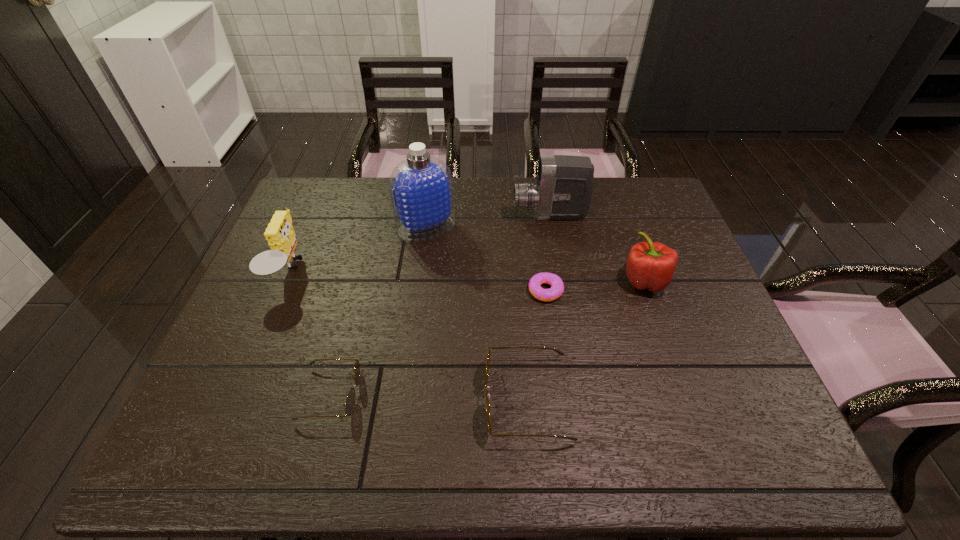
You are a GUI agent. You are given a task and a screenshot of the screen. Output one action in this format:
    pyautogui.click(x=<x>, y=<y>)
    Task: Click on the sixth object from right to left
    
    Given the screenshot: What is the action you would take?
    pyautogui.click(x=350, y=400)

Image resolution: width=960 pixels, height=540 pixels. Identify the location of the second shortest object. (350, 400).

At what (x,y) coordinates should I click in order to perform the action: click on the taller sunglasses. Please return your answer as a coordinate pair (x, y). The image size is (960, 540). Looking at the image, I should click on (560, 352).

I want to click on the third shortest object, so click(560, 352).

Where is `the sixth shortest object`? the sixth shortest object is located at coordinates (564, 186).

In order to click on the tallest object in this screenshot , I will do `click(421, 187)`.

At what (x,y) coordinates should I click in order to perform the action: click on cleansing agent. Please return your answer as a coordinate pair (x, y). The height and width of the screenshot is (540, 960). Looking at the image, I should click on (421, 187).

This screenshot has width=960, height=540. I want to click on the leftmost object, so click(x=280, y=235).

Where is `the fourth shortest object`? This screenshot has width=960, height=540. the fourth shortest object is located at coordinates (651, 265).

Identify the location of bell pepper. Image resolution: width=960 pixels, height=540 pixels. (651, 265).